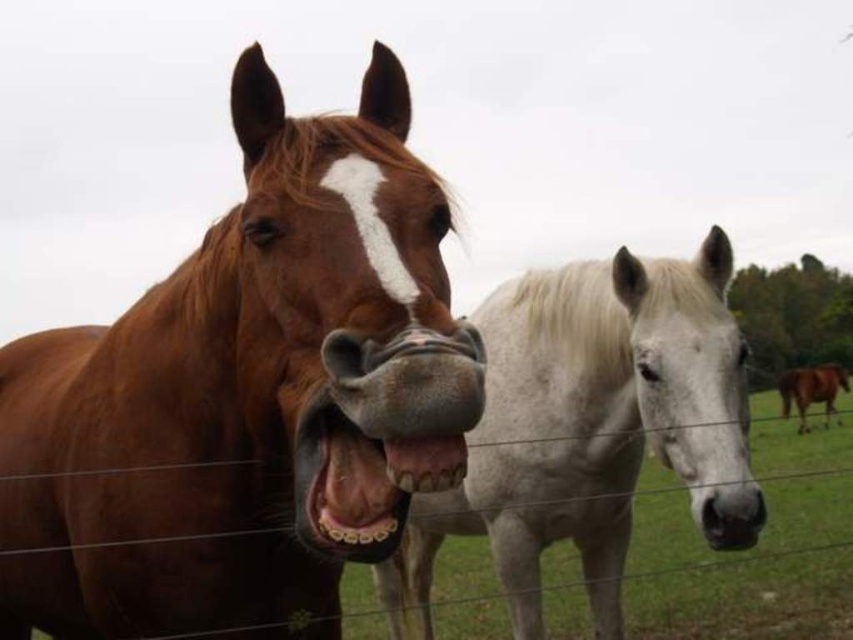
Can you confirm if white glossy horse at center is positioned to the right of teethporcelainmouth at center?

Indeed, white glossy horse at center is positioned on the right side of teethporcelainmouth at center.

Is white glossy horse at center closer to camera compared to teethporcelainmouth at center?

No, white glossy horse at center is behind teethporcelainmouth at center.

Who is more forward, (688, 300) or (331, 401)?

Point (331, 401) is in front.

Locate an element on the screen. The image size is (853, 640). white glossy horse at center is located at coordinates (585, 424).

Who is positioned more to the right, teeth metallic at center or brown glossy horse at right?

From the viewer's perspective, brown glossy horse at right appears more on the right side.

Can you confirm if teeth metallic at center is thinner than brown glossy horse at right?

Yes.

Find the location of a particular element. teeth metallic at center is located at coordinates (425, 461).

Locate an element on the screen. The width and height of the screenshot is (853, 640). teeth metallic at center is located at coordinates (425, 461).

Can you confirm if brown glossy horse at left is shorter than teeth metallic at center?

Incorrect, brown glossy horse at left's height does not fall short of teeth metallic at center's.

Which is in front, point (12, 413) or point (421, 474)?

Point (421, 474) is more forward.

You are a GUI agent. You are given a task and a screenshot of the screen. Output one action in this format:
    pyautogui.click(x=<x>, y=<y>)
    Task: Click on the brown glossy horse at left
    Image resolution: width=853 pixels, height=640 pixels.
    Given the screenshot: What is the action you would take?
    pyautogui.click(x=242, y=396)